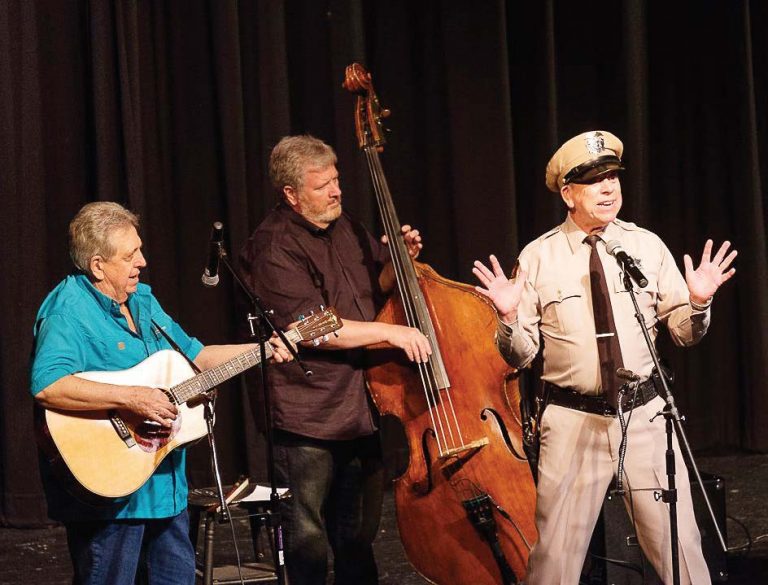
Where is `curtain`? curtain is located at coordinates (220, 191).